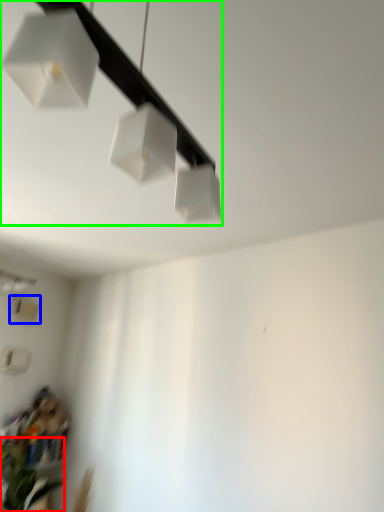
Question: Estimate the real-world distances between objects in this image. Which object is farther from plant (highlighted by a red box), lamp (highlighted by a blue box) or lamp (highlighted by a green box)?

Choices:
 (A) lamp
 (B) lamp

Answer: (B)